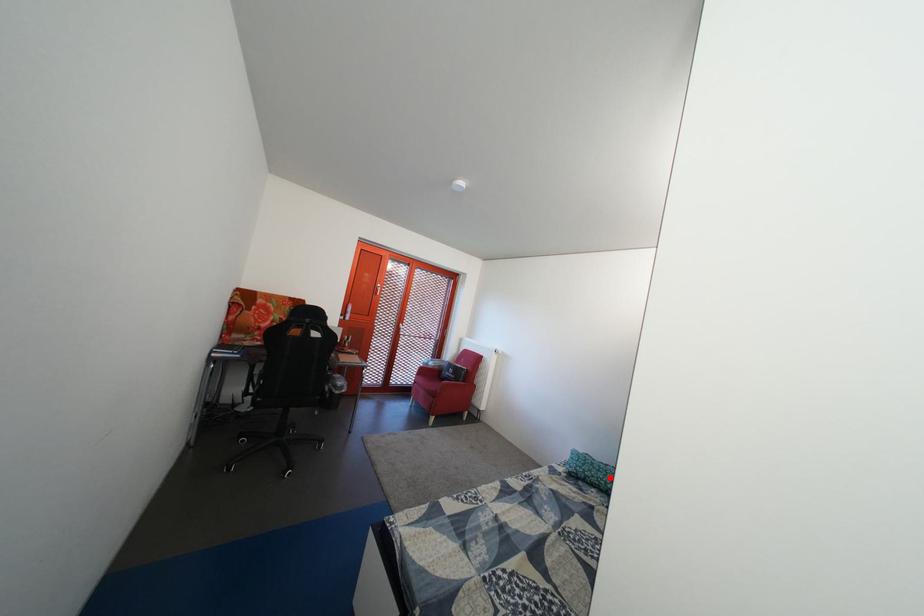
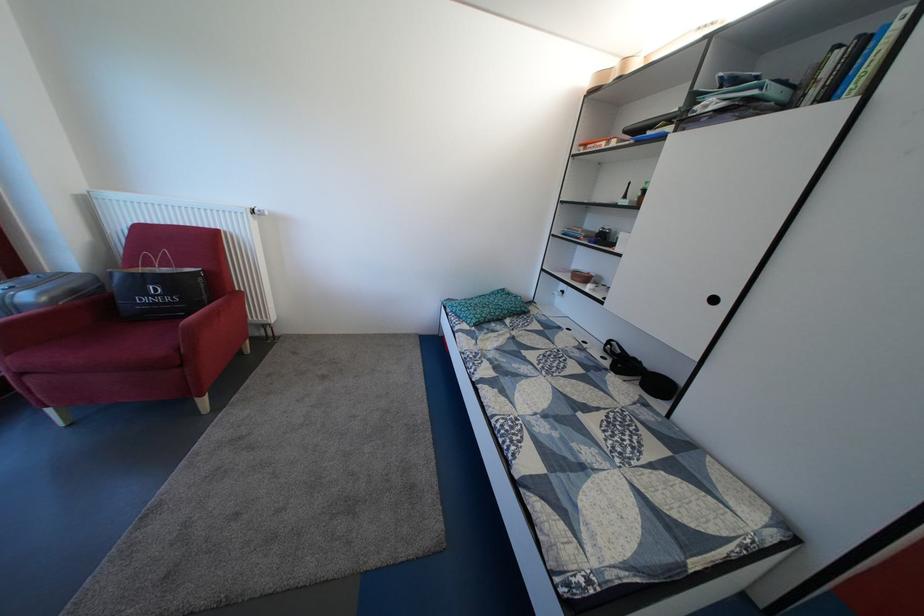
Question: I am providing you with two images of the same scene from different viewpoints. Image1 has a red point marked. In image2, the corresponding 3D location appears at what relative position? Reply with the corresponding letter.

Choices:
 (A) Closer
 (B) Farther

Answer: (B)